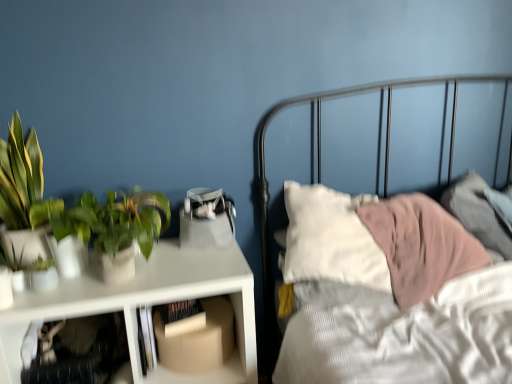
The height and width of the screenshot is (384, 512). What are the coordinates of `vacant area situated below green matte plant at left (from a real-world perspective)` in the screenshot? It's located at (148, 257).